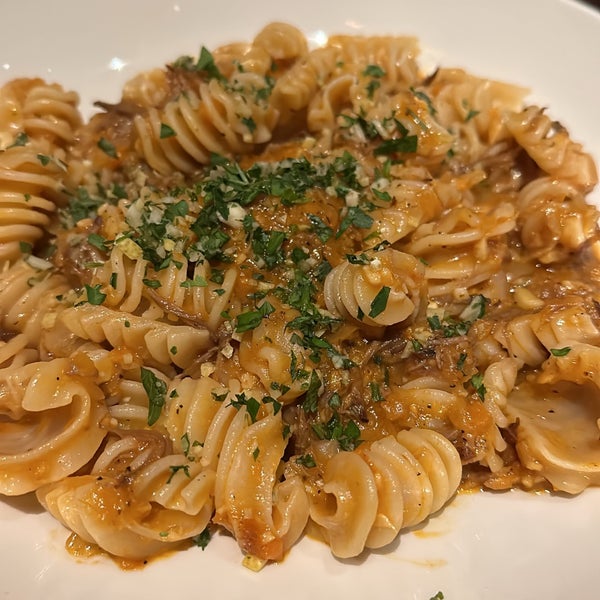
At what (x,y) coordinates should I click in order to perform the action: click on plate. Please return your answer as a coordinate pair (x, y). Looking at the image, I should click on (511, 534).